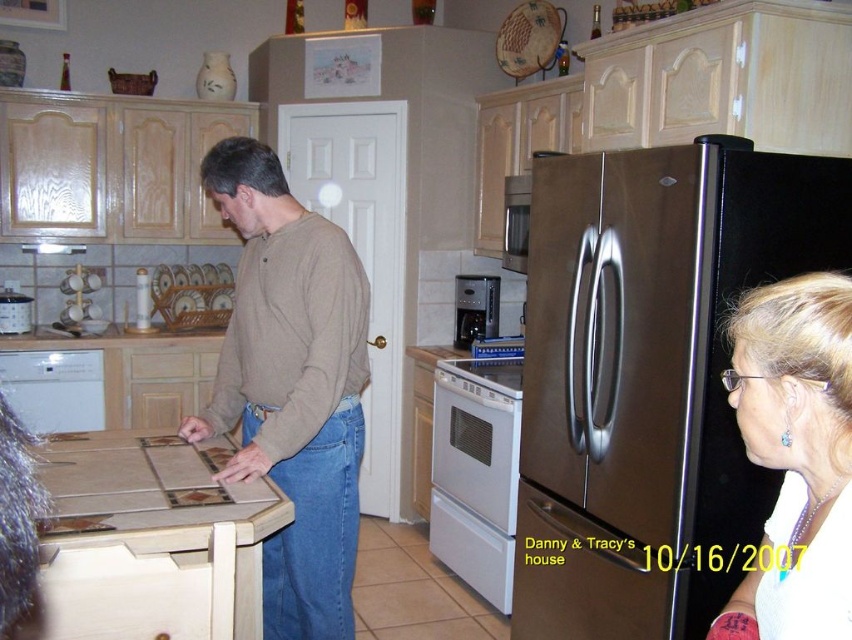
Which is in front, point (465, 522) or point (10, 308)?

Positioned in front is point (465, 522).

Image resolution: width=852 pixels, height=640 pixels. Find the location of `white glossy oven at center`. white glossy oven at center is located at coordinates (475, 472).

Who is more forward, [471,518] or [9,307]?

Positioned in front is point [471,518].

Find the location of `white glossy oven at center`. white glossy oven at center is located at coordinates (475, 472).

Describe the element at coordinates (55, 388) in the screenshot. I see `white glossy dishwasher at lower left` at that location.

Is point (41, 371) in front of point (32, 320)?

Yes, it is in front of point (32, 320).

The image size is (852, 640). In order to click on white glossy dishwasher at lower left in this screenshot , I will do `click(55, 388)`.

Who is taller, stainless steel refrigerator at right or brushed metal coffee pot at left?

stainless steel refrigerator at right is taller.

Where is `stainless steel refrigerator at right`? The height and width of the screenshot is (640, 852). stainless steel refrigerator at right is located at coordinates coord(649,378).